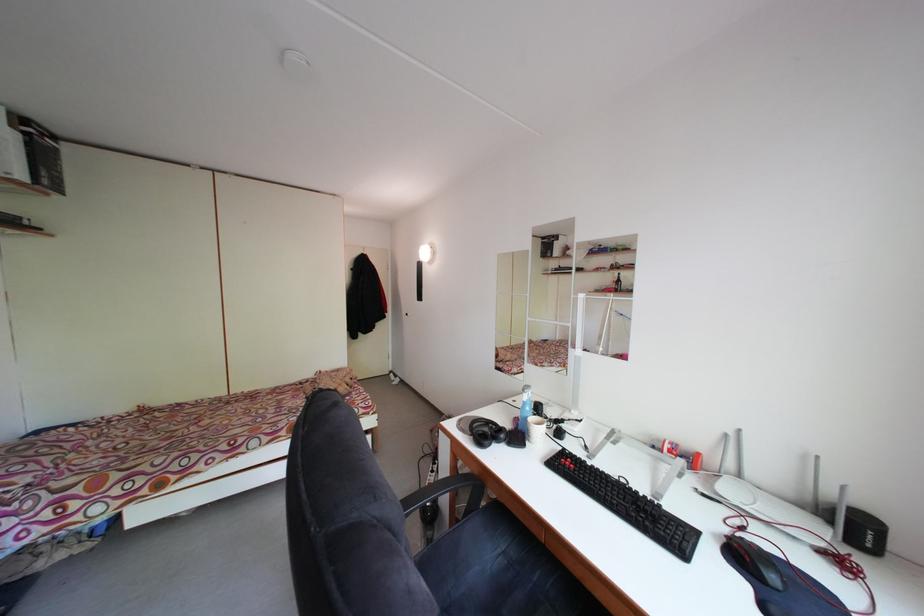
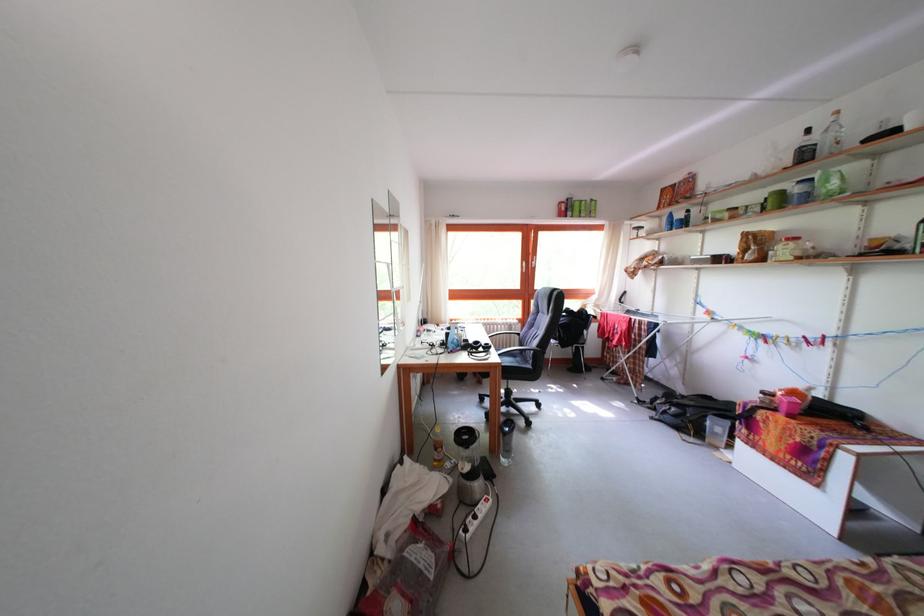
The point at (x=488, y=440) is marked in the first image. Where is the corresponding point in the second image?

(495, 353)